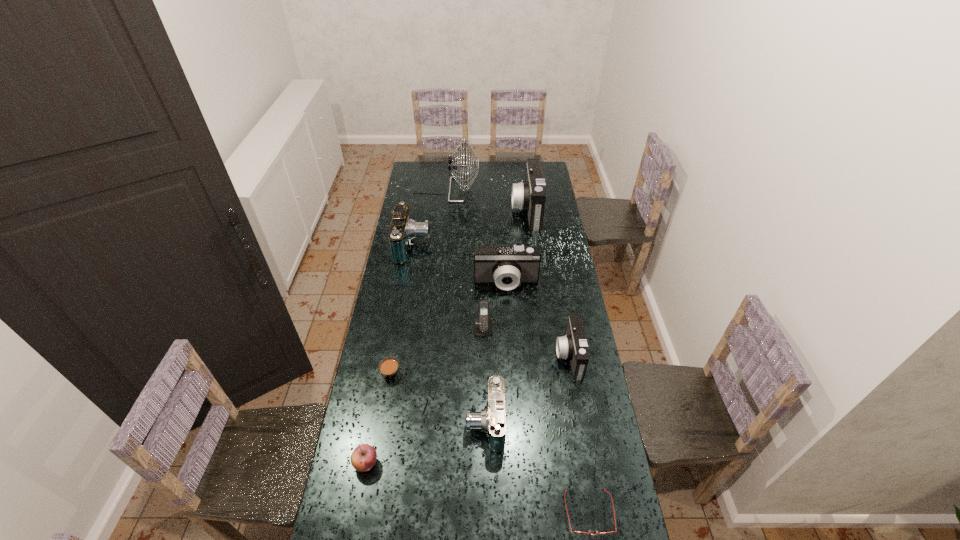
The image size is (960, 540). Find the location of `blank space located on the lens of the ninth shortest object`. blank space located on the lens of the ninth shortest object is located at coordinates (483, 210).

Locate an element on the screen. free space located on the lens of the second farthest black camcorder is located at coordinates (x=509, y=319).

The image size is (960, 540). Identify the location of free spot located 0.190m on the front-facing side of the left blue camcorder. 468,245.

Locate an element on the screen. The image size is (960, 540). free spot located on the front-facing side of the cellular telephone is located at coordinates tap(485, 424).

Locate an element on the screen. The image size is (960, 540). free region located 0.090m on the lens of the smallest black camcorder is located at coordinates (534, 356).

Identify the location of blank space located on the lens of the smallest black camcorder. (529, 356).

Image resolution: width=960 pixels, height=540 pixels. Identify the location of vacant point located 0.280m on the lens of the smallest black camcorder. (486, 356).

Locate an element on the screen. This screenshot has height=540, width=960. free space located on the front-facing side of the nearest camcorder is located at coordinates (451, 422).

Identify the location of vacant space situated 0.070m on the front-facing side of the nearest camcorder. The image size is (960, 540). (446, 422).

Find the location of a particular element. Image resolution: width=960 pixels, height=540 pixels. free space located 0.200m on the front-facing side of the nearest camcorder is located at coordinates (409, 422).